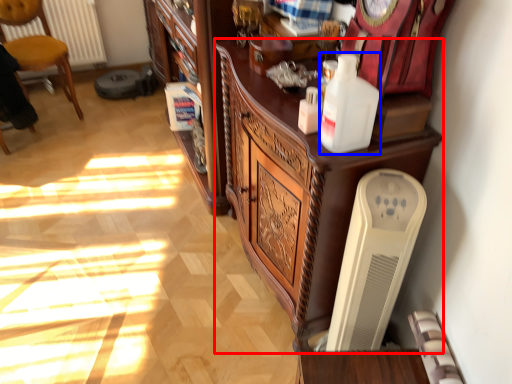
Question: Which object appears farthest to the camera in this image, cabinetry (highlighted by a red box) or bottle (highlighted by a blue box)?

Choices:
 (A) cabinetry
 (B) bottle

Answer: (A)